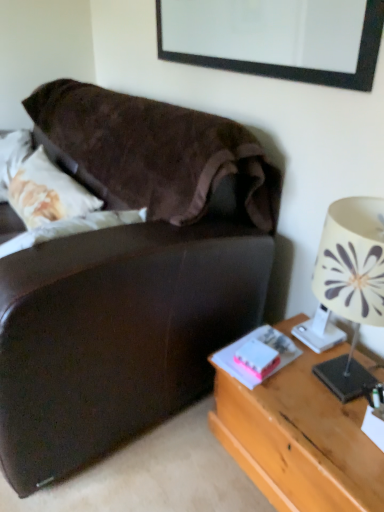
Question: Could you tell me if black matte picture frame at upper center is turned towards white matte book at lower right, the 1th book viewed from the left?

Choices:
 (A) no
 (B) yes

Answer: (A)

Question: Is black matte picture frame at upper center oriented away from white matte book at lower right, which is the second book from right to left?

Choices:
 (A) yes
 (B) no

Answer: (B)

Question: Can you confirm if black matte picture frame at upper center is wider than white matte book at lower right, the 1th book viewed from the left?

Choices:
 (A) no
 (B) yes

Answer: (A)

Question: Does black matte picture frame at upper center come behind white matte book at lower right, which is the second book from right to left?

Choices:
 (A) yes
 (B) no

Answer: (B)

Question: Would you say black matte picture frame at upper center is a long distance from white matte book at lower right, which is the second book from right to left?

Choices:
 (A) no
 (B) yes

Answer: (A)

Question: Is black matte picture frame at upper center to the right of white matte book at lower right, the 1th book viewed from the left, from the viewer's perspective?

Choices:
 (A) yes
 (B) no

Answer: (B)

Question: Does pink matte book at lower right, which ranks as the first book in right-to-left order, lie behind white fabric lampshade at right?

Choices:
 (A) no
 (B) yes

Answer: (B)

Question: Can you confirm if pink matte book at lower right, acting as the second book starting from the left, is wider than white fabric lampshade at right?

Choices:
 (A) yes
 (B) no

Answer: (B)

Question: Does pink matte book at lower right, which ranks as the first book in right-to-left order, have a lesser width compared to white fabric lampshade at right?

Choices:
 (A) no
 (B) yes

Answer: (B)

Question: Can we say pink matte book at lower right, acting as the second book starting from the left, lies outside white fabric lampshade at right?

Choices:
 (A) no
 (B) yes

Answer: (B)

Question: Is pink matte book at lower right, acting as the second book starting from the left, looking in the opposite direction of white fabric lampshade at right?

Choices:
 (A) no
 (B) yes

Answer: (A)

Question: Is pink matte book at lower right, which ranks as the first book in right-to-left order, aimed at white fabric lampshade at right?

Choices:
 (A) no
 (B) yes

Answer: (A)

Question: From a real-world perspective, is black matte picture frame at upper center under pink matte book at lower right, acting as the second book starting from the left?

Choices:
 (A) yes
 (B) no

Answer: (B)